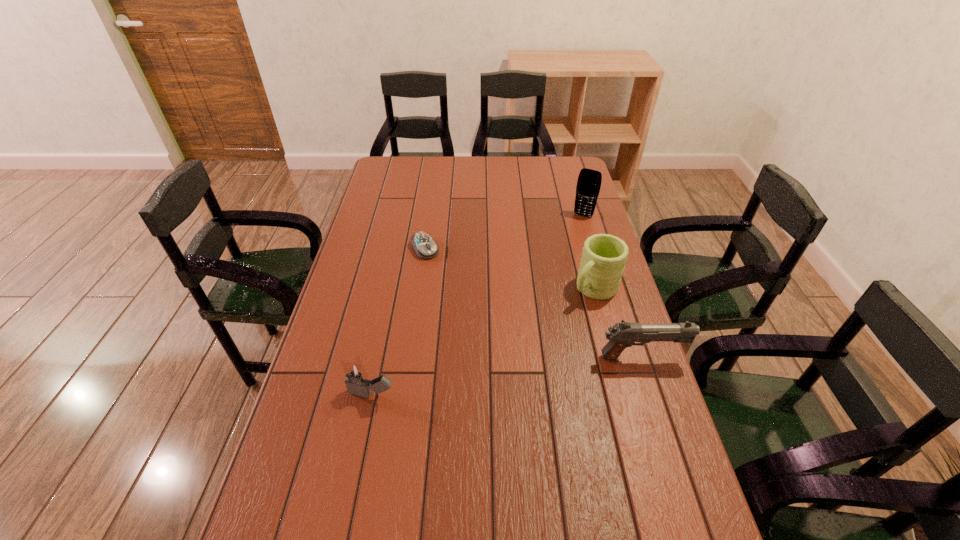
Find the location of a particular element. This screenshot has height=540, width=960. igniter is located at coordinates (357, 383).

Where is `the fourth farthest object`? This screenshot has width=960, height=540. the fourth farthest object is located at coordinates (622, 335).

The width and height of the screenshot is (960, 540). Identify the location of computer mouse. (425, 247).

Image resolution: width=960 pixels, height=540 pixels. In order to click on the fourth nearest object in this screenshot , I will do `click(425, 247)`.

This screenshot has height=540, width=960. What are the coordinates of `the third nearest object` in the screenshot? It's located at (604, 256).

This screenshot has height=540, width=960. Find the location of `cellular telephone`. cellular telephone is located at coordinates (589, 181).

The width and height of the screenshot is (960, 540). I want to click on the tallest object, so click(x=589, y=181).

Find the location of `free location located on the back of the nearest object`. free location located on the back of the nearest object is located at coordinates (393, 296).

Where is `vacant area situated 0.270m on the wheel side of the second farthest object`? The width and height of the screenshot is (960, 540). vacant area situated 0.270m on the wheel side of the second farthest object is located at coordinates (466, 308).

The image size is (960, 540). What are the coordinates of `vacant space located 0.110m on the wheel side of the second farthest object` in the screenshot? It's located at (444, 278).